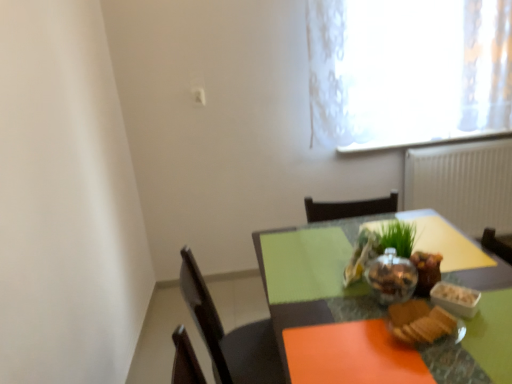
What do you see at coordinates (426, 271) in the screenshot? Image resolution: width=512 pixels, height=384 pixels. I see `shiny metallic bowl at center, the first food positioned from the back` at bounding box center [426, 271].

Find the location of a particular element. white textured radiator at right is located at coordinates (463, 184).

What are the coordinates of `green glass table at center` in the screenshot? It's located at (373, 312).

The width and height of the screenshot is (512, 384). In order to click on slightly toasted bread at lower right, acting as the third food starting from the back in this screenshot , I will do `click(420, 322)`.

What is the approximate width of slightly toasted bread at lower right, acting as the third food starting from the back?

It is 6.36 inches.

Where is `shiny metallic bowl at center, the first food positioned from the back`? shiny metallic bowl at center, the first food positioned from the back is located at coordinates (426, 271).

Consider the image. Between shiny metallic bowl at center, which is the 2th food in back-to-front order, and white textured radiator at right, which one has more height?

white textured radiator at right is taller.

Is shiny metallic bowl at center, the second food from the front, oriented away from white textured radiator at right?

No, shiny metallic bowl at center, the second food from the front, is not facing the opposite direction of white textured radiator at right.

Looking at this image, from the image's perspective, is shiny metallic bowl at center, which is the 2th food in back-to-front order, above or below white textured radiator at right?

shiny metallic bowl at center, which is the 2th food in back-to-front order, is below white textured radiator at right.

Considering the relative sizes of shiny metallic bowl at center, the second food from the front, and white textured radiator at right in the image provided, is shiny metallic bowl at center, the second food from the front, thinner than white textured radiator at right?

Incorrect, the width of shiny metallic bowl at center, the second food from the front, is not less than that of white textured radiator at right.

This screenshot has width=512, height=384. What are the coordinates of `radiator below the slightly toasted bread at lower right, the first food in the front-to-back sequence (from a real-world perspective)` in the screenshot? It's located at (463, 184).

Is slightly toasted bread at lower right, acting as the third food starting from the back, in front of or behind white textured radiator at right in the image?

Clearly, slightly toasted bread at lower right, acting as the third food starting from the back, is in front of white textured radiator at right.

Is slightly toasted bread at lower right, the first food in the front-to-back sequence, facing towards white textured radiator at right?

No, slightly toasted bread at lower right, the first food in the front-to-back sequence, is not oriented towards white textured radiator at right.

Considering the sizes of objects green glass table at center and matte glass bowl at center in the image provided, who is bigger, green glass table at center or matte glass bowl at center?

With larger size is green glass table at center.

Which is in front, point (383, 366) or point (367, 237)?

The point (383, 366) is closer to the camera.

Would you say green glass table at center is a long distance from matte glass bowl at center?

No, there isn't a large distance between green glass table at center and matte glass bowl at center.

From the image's perspective, is green glass table at center above matte glass bowl at center?

No, from the image's perspective, green glass table at center is not on top of matte glass bowl at center.

Between green glass table at center and slightly toasted bread at lower right, the first food in the front-to-back sequence, which one appears on the left side from the viewer's perspective?

slightly toasted bread at lower right, the first food in the front-to-back sequence.

Is green glass table at center looking in the opposite direction of slightly toasted bread at lower right, acting as the third food starting from the back?

That's not correct — green glass table at center is not looking away from slightly toasted bread at lower right, acting as the third food starting from the back.

Is green glass table at center not close to slightly toasted bread at lower right, the first food in the front-to-back sequence?

They are positioned close to each other.

In terms of width, does shiny metallic bowl at center, which is the third food from front to back, look wider or thinner when compared to shiny metallic bowl at center, which is the 2th food in back-to-front order?

Considering their sizes, shiny metallic bowl at center, which is the third food from front to back, looks slimmer than shiny metallic bowl at center, which is the 2th food in back-to-front order.

How different are the orientations of shiny metallic bowl at center, which is the third food from front to back, and shiny metallic bowl at center, which is the 2th food in back-to-front order, in degrees?

There is a 7.85-degree angle between the facing directions of shiny metallic bowl at center, which is the third food from front to back, and shiny metallic bowl at center, which is the 2th food in back-to-front order.

From a real-world perspective, is shiny metallic bowl at center, which is the third food from front to back, under shiny metallic bowl at center, which is the 2th food in back-to-front order?

Correct, in the physical world, shiny metallic bowl at center, which is the third food from front to back, is lower than shiny metallic bowl at center, which is the 2th food in back-to-front order.

Can you confirm if shiny metallic bowl at center, the first food positioned from the back, is smaller than shiny metallic bowl at center, the second food from the front?

Indeed, shiny metallic bowl at center, the first food positioned from the back, has a smaller size compared to shiny metallic bowl at center, the second food from the front.

Is shiny metallic bowl at center, which is the 2th food in back-to-front order, to the right of matte glass bowl at center from the viewer's perspective?

In fact, shiny metallic bowl at center, which is the 2th food in back-to-front order, is to the left of matte glass bowl at center.

Is shiny metallic bowl at center, which is the 2th food in back-to-front order, in contact with matte glass bowl at center?

Absolutely, shiny metallic bowl at center, which is the 2th food in back-to-front order, is next to and touching matte glass bowl at center.

Considering the positions of objects shiny metallic bowl at center, the second food from the front, and matte glass bowl at center in the image provided, who is behind, shiny metallic bowl at center, the second food from the front, or matte glass bowl at center?

shiny metallic bowl at center, the second food from the front.

From the image's perspective, is shiny metallic bowl at center, the second food from the front, below matte glass bowl at center?

Incorrect, from the image's perspective, shiny metallic bowl at center, the second food from the front, is higher than matte glass bowl at center.

Can you tell me how much slightly toasted bread at lower right, acting as the third food starting from the back, and shiny metallic bowl at center, which is the 2th food in back-to-front order, differ in facing direction?

1.96 degrees separate the facing orientations of slightly toasted bread at lower right, acting as the third food starting from the back, and shiny metallic bowl at center, which is the 2th food in back-to-front order.

From a real-world perspective, who is located lower, slightly toasted bread at lower right, the first food in the front-to-back sequence, or shiny metallic bowl at center, which is the 2th food in back-to-front order?

slightly toasted bread at lower right, the first food in the front-to-back sequence, is physically lower.

Consider the image. Is slightly toasted bread at lower right, acting as the third food starting from the back, spatially inside shiny metallic bowl at center, the second food from the front, or outside of it?

The correct answer is: outside.

From the image's perspective, who appears lower, slightly toasted bread at lower right, acting as the third food starting from the back, or shiny metallic bowl at center, the second food from the front?

slightly toasted bread at lower right, acting as the third food starting from the back, from the image's perspective.

Which food is the 2nd one when counting from the front of the white textured radiator at right? Please provide its 2D coordinates.

[(393, 253)]

In order to click on radiator behind the slightly toasted bread at lower right, the first food in the front-to-back sequence in this screenshot , I will do `click(463, 184)`.

Looking at the image, which one is located further to shiny metallic bowl at center, which is the third food from front to back, shiny metallic bowl at center, the second food from the front, or matte glass bowl at center?

matte glass bowl at center.

From the image, which object appears to be nearer to matte glass bowl at center, green glass table at center or slightly toasted bread at lower right, the first food in the front-to-back sequence?

slightly toasted bread at lower right, the first food in the front-to-back sequence.

Looking at the image, which one is located closer to shiny metallic bowl at center, which is the third food from front to back, white textured radiator at right or slightly toasted bread at lower right, the first food in the front-to-back sequence?

slightly toasted bread at lower right, the first food in the front-to-back sequence, is closer to shiny metallic bowl at center, which is the third food from front to back.

Considering their positions, is shiny metallic bowl at center, the second food from the front, positioned further to green glass table at center than white textured radiator at right?

white textured radiator at right lies further to green glass table at center than the other object.

Looking at the image, which one is located closer to white textured radiator at right, green glass table at center or shiny metallic bowl at center, which is the 2th food in back-to-front order?

green glass table at center is positioned closer to the anchor white textured radiator at right.

Based on their spatial positions, is matte glass bowl at center or shiny metallic bowl at center, the first food positioned from the back, closer to shiny metallic bowl at center, the second food from the front?

matte glass bowl at center is positioned closer to the anchor shiny metallic bowl at center, the second food from the front.

Which object lies further to the anchor point shiny metallic bowl at center, which is the 2th food in back-to-front order, green glass table at center or matte glass bowl at center?

green glass table at center lies further to shiny metallic bowl at center, which is the 2th food in back-to-front order, than the other object.

When comparing their distances from shiny metallic bowl at center, the first food positioned from the back, does matte glass bowl at center or slightly toasted bread at lower right, acting as the third food starting from the back, seem further?

Among the two, slightly toasted bread at lower right, acting as the third food starting from the back, is located further to shiny metallic bowl at center, the first food positioned from the back.

Identify the location of meal between shiny metallic bowl at center, which is the 2th food in back-to-front order, and green glass table at center in the up-down direction. coord(371,245).

At what (x,y) coordinates should I click in order to perform the action: click on food located between slightly toasted bread at lower right, acting as the third food starting from the back, and shiny metallic bowl at center, the first food positioned from the back, in the depth direction. Please return your answer as a coordinate pair (x, y). Looking at the image, I should click on (393, 253).

Where is `meal between slightly toasted bread at lower right, the first food in the front-to-back sequence, and white textured radiator at right in the front-back direction`? This screenshot has width=512, height=384. meal between slightly toasted bread at lower right, the first food in the front-to-back sequence, and white textured radiator at right in the front-back direction is located at coordinates (371, 245).

The image size is (512, 384). I want to click on meal between shiny metallic bowl at center, which is the third food from front to back, and green glass table at center vertically, so click(371, 245).